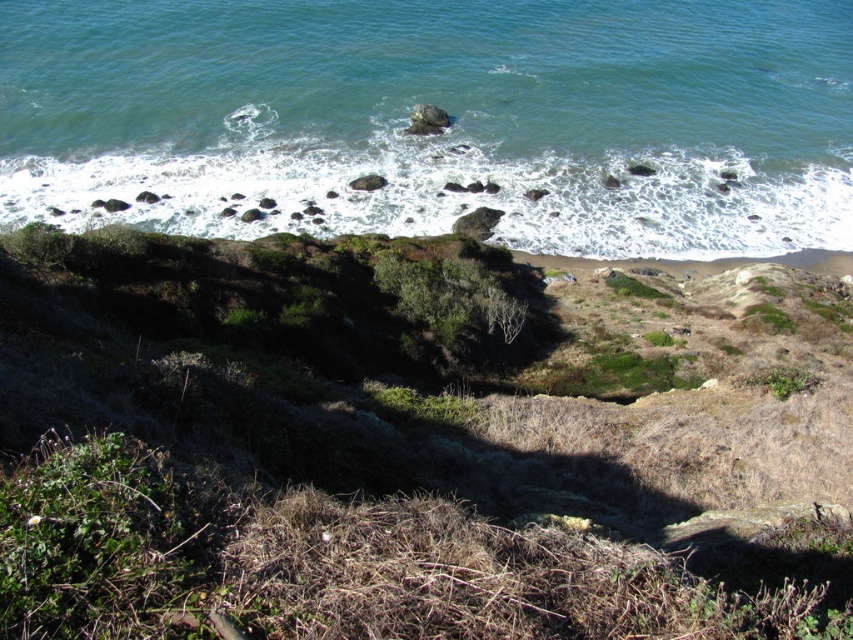
Can you confirm if green grassy hillside at center is thinner than clear blue water at upper center?

Indeed, green grassy hillside at center has a lesser width compared to clear blue water at upper center.

Which of these two, green grassy hillside at center or clear blue water at upper center, stands shorter?

green grassy hillside at center is shorter.

The image size is (853, 640). I want to click on green grassy hillside at center, so click(x=412, y=445).

I want to click on green grassy hillside at center, so click(x=412, y=445).